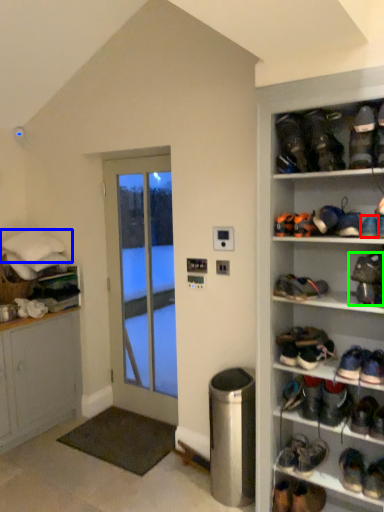
Question: Estimate the real-world distances between objects in this image. Which object is farther from footwear (highlighted by a red box), cushion (highlighted by a blue box) or footwear (highlighted by a green box)?

Choices:
 (A) cushion
 (B) footwear

Answer: (A)